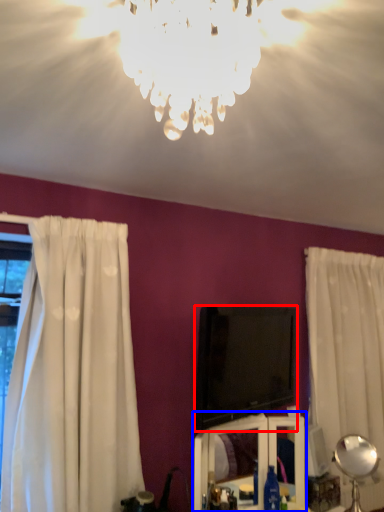
Question: Which of the following is the closest to the observer, television (highlighted by a red box) or vanity (highlighted by a blue box)?

Choices:
 (A) television
 (B) vanity

Answer: (B)